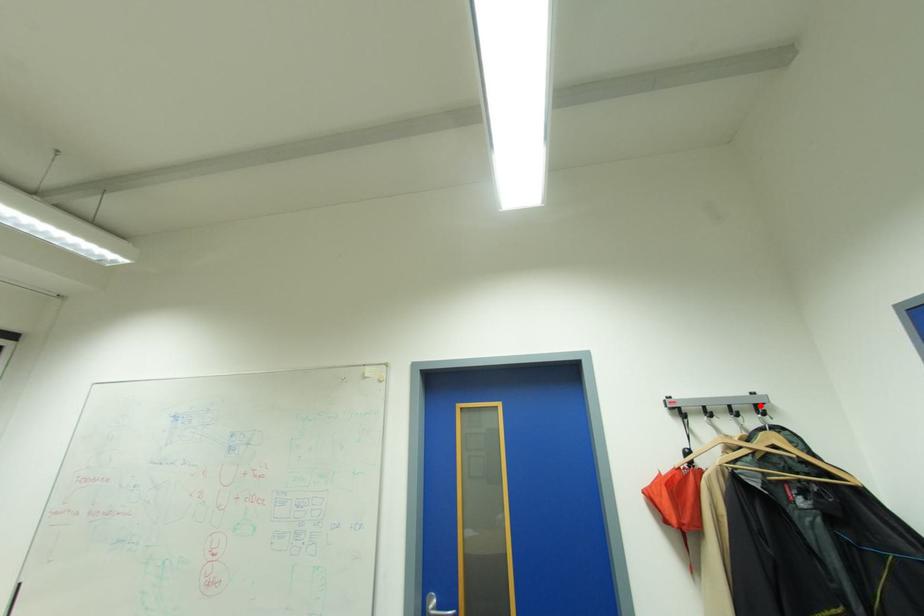
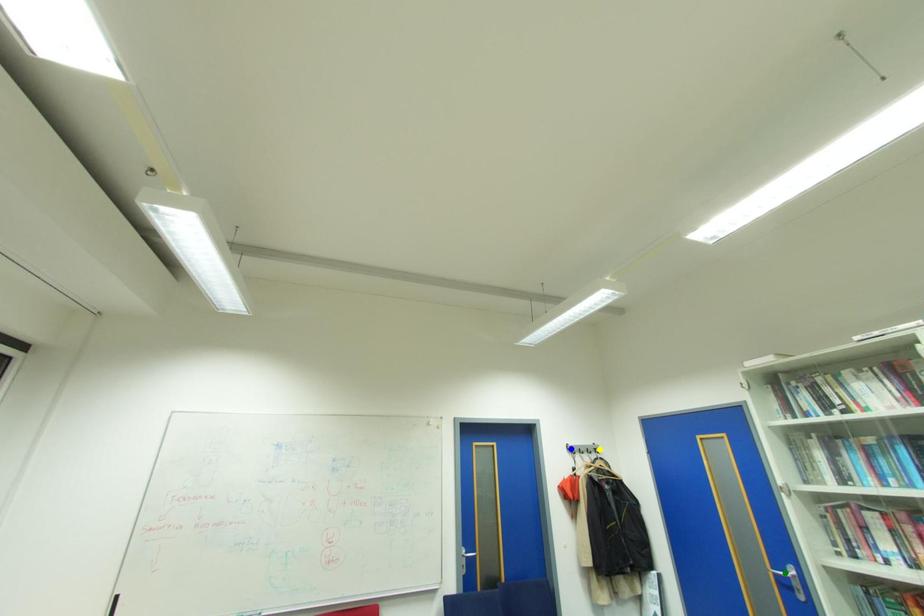
Question: I am providing you with two images of the same scene from different viewpoints. A red point is marked on the first image. You are given multiple points on the second image. Can you choose the point in image 2 that corresponds to the point in image 1?

Choices:
 (A) green point
 (B) blue point
 (C) yellow point

Answer: (C)